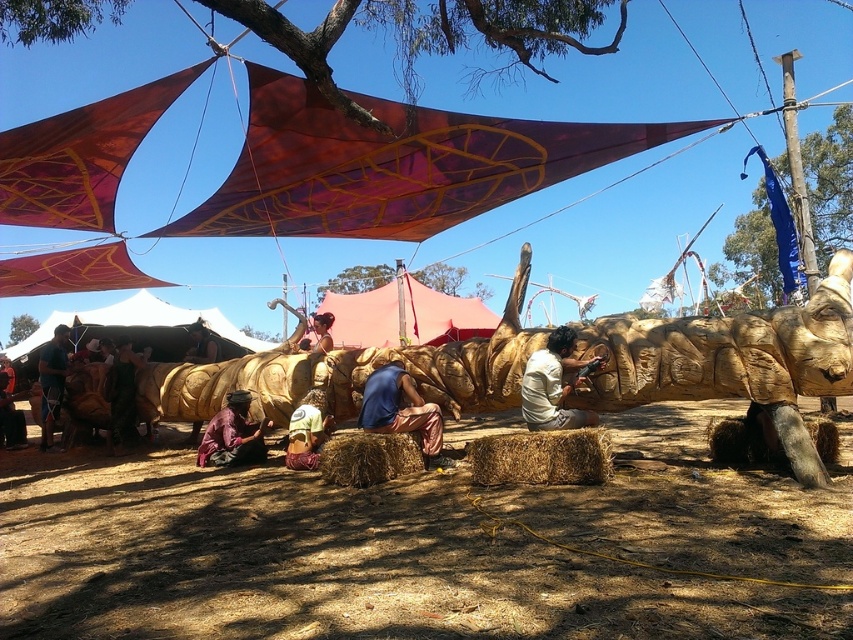
You are an artist planning to paint a scene of the outdoor area. You need to know if the brown wood tree at upper center is wider than the wooden figure at center. Can you confirm this?

Answer: The brown wood tree at upper center is wider than the wooden figure at center because its width surpasses that of the wooden figure at center.

You are an architect designing a new park layout. You need to place a new bench exactly at the coordinates where the brown wood tree at upper center is located. What are the coordinates where you should place the bench?

The coordinates for the brown wood tree at upper center are at point (x=428, y=33), so you should place the bench at those coordinates.